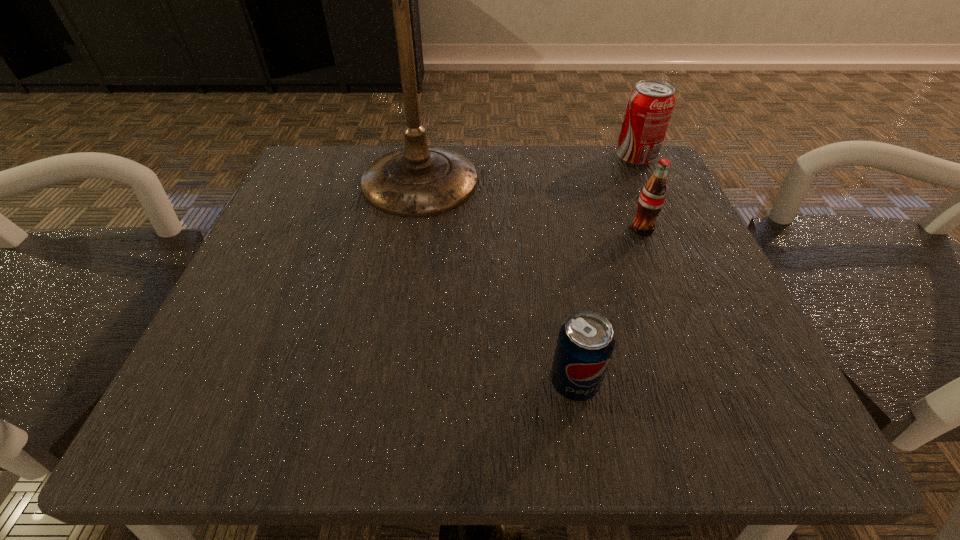
Identify the location of table lamp located at the far edge. The image size is (960, 540). (417, 181).

Find the location of a particular element. soda at the far edge is located at coordinates (650, 105).

The height and width of the screenshot is (540, 960). What are the coordinates of `object that is at the near edge` in the screenshot? It's located at (585, 344).

Locate an element on the screen. The image size is (960, 540). object at the left edge is located at coordinates 417,181.

This screenshot has width=960, height=540. I want to click on object at the far left corner, so click(417, 181).

Locate an element on the screen. The image size is (960, 540). object that is at the far right corner is located at coordinates (650, 105).

Locate an element on the screen. The image size is (960, 540). vacant space at the near edge of the desktop is located at coordinates (547, 406).

Locate an element on the screen. The image size is (960, 540). free space at the left edge of the desktop is located at coordinates (252, 272).

Locate an element on the screen. vacant space at the right edge is located at coordinates (725, 316).

The image size is (960, 540). What are the coordinates of `free space at the far left corner` in the screenshot? It's located at (332, 196).